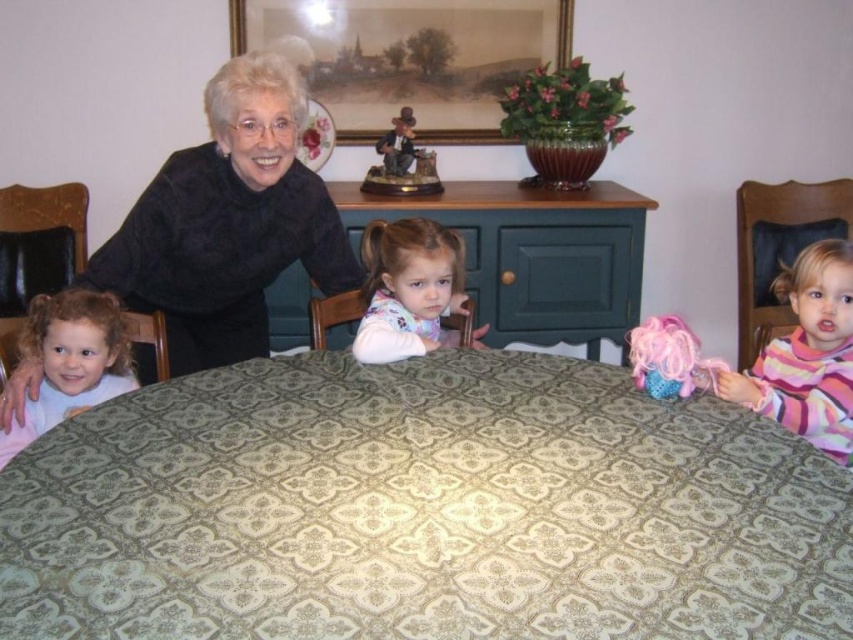
You are a guest entering the dining room and want to sit at the green fabric table at center. The black textured blouse at left is blocking your path. Can you walk around it to reach the table?

The black textured blouse at left is in front of the green fabric table at center, so you can walk around it to reach the table since it is blocking the path directly but not the sides.

You are a guest entering the dining room and see the black textured blouse at left and the green fabric table at center. Which object is positioned higher in the image?

The black textured blouse at left is much taller as green fabric table at center, so the black textured blouse at left is positioned higher in the image.

You are a guest entering the dining room and want to admire the wooden framed picture at upper center and the fluffy pink sweater at center. Which object can you see more clearly from your current position?

The wooden framed picture at upper center is closer to you than the fluffy pink sweater at center, so you can see the wooden framed picture at upper center more clearly.